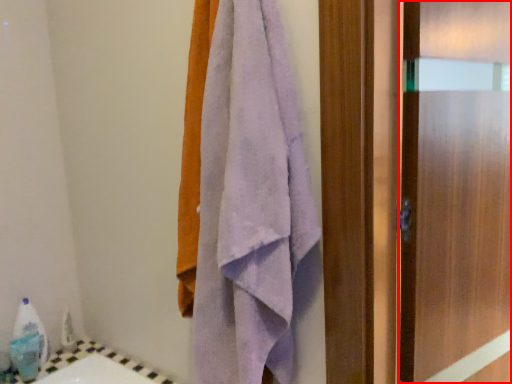
Question: Observing the image, what is the correct spatial positioning of screen door (annotated by the red box) in reference to towel?

Choices:
 (A) right
 (B) left

Answer: (A)